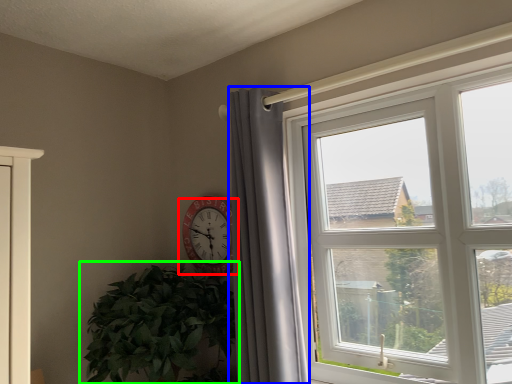
Question: Which object is positioned closest to wall clock (highlighted by a red box)? Select from curtain (highlighted by a blue box) and houseplant (highlighted by a green box).

Choices:
 (A) curtain
 (B) houseplant

Answer: (B)